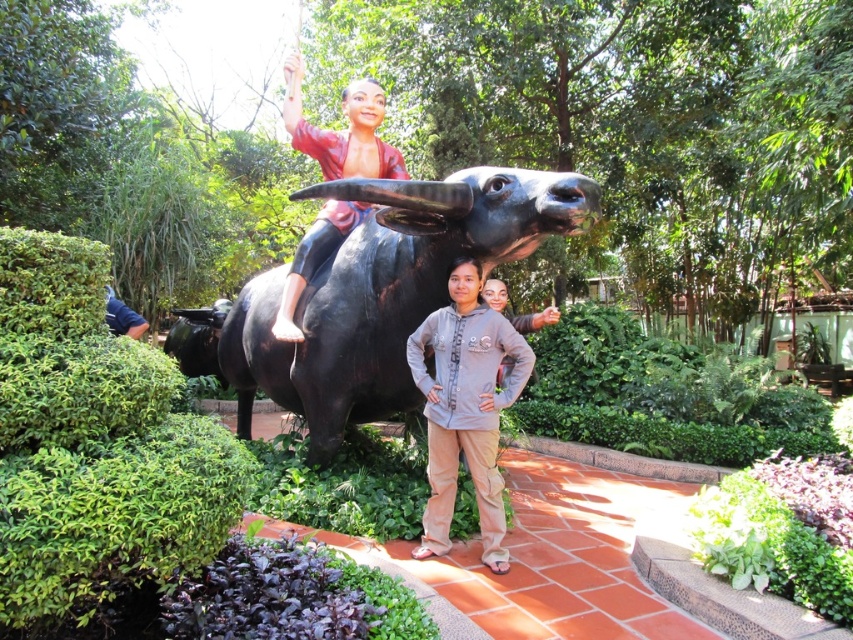
Measure the distance between gray cotton hoodie at center and polished wood statue at center.

They are 2.05 meters apart.

Is gray cotton hoodie at center to the left of polished wood statue at center from the viewer's perspective?

Incorrect, gray cotton hoodie at center is not on the left side of polished wood statue at center.

Find the location of a particular element. gray cotton hoodie at center is located at coordinates (465, 408).

Who is more forward, (474, 387) or (131, 316)?

Point (474, 387) is more forward.

I want to click on gray cotton hoodie at center, so click(465, 408).

At what (x,y) coordinates should I click in order to perform the action: click on gray cotton hoodie at center. Please return your answer as a coordinate pair (x, y). This screenshot has width=853, height=640. Looking at the image, I should click on (465, 408).

Does shiny black bull at center have a greater width compared to polished wood statue at center?

Yes, shiny black bull at center is wider than polished wood statue at center.

Locate an element on the screen. The image size is (853, 640). shiny black bull at center is located at coordinates (386, 291).

In order to click on shiny black bull at center in this screenshot , I will do `click(386, 291)`.